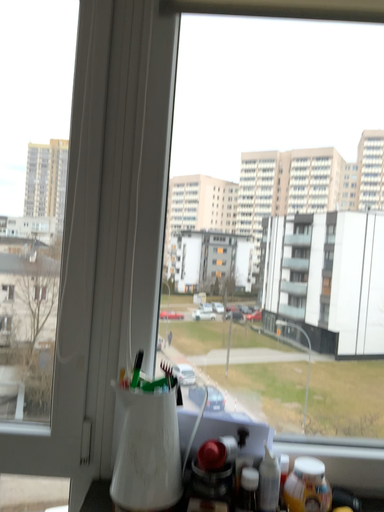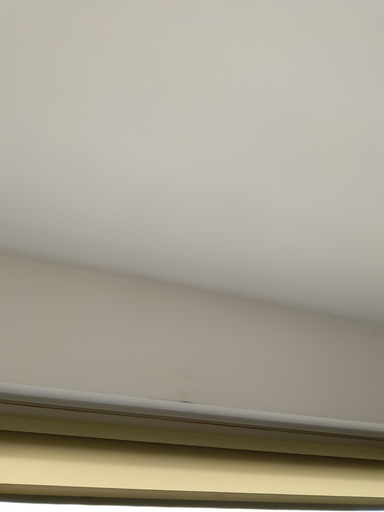
Question: How did the camera likely rotate when shooting the video?

Choices:
 (A) rotated downward
 (B) rotated upward

Answer: (B)